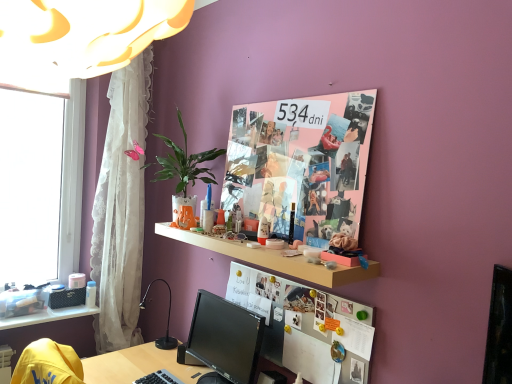
Question: Considering the relative sizes of clear plastic storage at lower left, which is the first shelf in back-to-front order, and whiteboard at center in the image provided, is clear plastic storage at lower left, which is the first shelf in back-to-front order, bigger than whiteboard at center?

Choices:
 (A) yes
 (B) no

Answer: (B)

Question: Considering the relative sizes of clear plastic storage at lower left, arranged as the 1th shelf when viewed from the left, and whiteboard at center in the image provided, is clear plastic storage at lower left, arranged as the 1th shelf when viewed from the left, shorter than whiteboard at center?

Choices:
 (A) yes
 (B) no

Answer: (A)

Question: Are clear plastic storage at lower left, arranged as the 1th shelf when viewed from the left, and whiteboard at center located far from each other?

Choices:
 (A) no
 (B) yes

Answer: (B)

Question: Does clear plastic storage at lower left, the first shelf from the bottom, have a smaller size compared to whiteboard at center?

Choices:
 (A) yes
 (B) no

Answer: (A)

Question: Does clear plastic storage at lower left, which appears as the 2th shelf when viewed from the front, lie behind whiteboard at center?

Choices:
 (A) yes
 (B) no

Answer: (A)

Question: From the image's perspective, is pink paper collage at upper center above or below smooth skin face at upper center?

Choices:
 (A) above
 (B) below

Answer: (B)

Question: Considering the positions of pink paper collage at upper center and smooth skin face at upper center in the image, is pink paper collage at upper center taller or shorter than smooth skin face at upper center?

Choices:
 (A) tall
 (B) short

Answer: (A)

Question: Is point (304, 185) positioned closer to the camera than point (267, 135)?

Choices:
 (A) farther
 (B) closer

Answer: (B)

Question: Considering the relative positions of pink paper collage at upper center and smooth skin face at upper center in the image provided, is pink paper collage at upper center to the left or to the right of smooth skin face at upper center?

Choices:
 (A) left
 (B) right

Answer: (B)

Question: Considering the positions of black glossy monitor at center and black plastic keyboard at lower center in the image, is black glossy monitor at center bigger or smaller than black plastic keyboard at lower center?

Choices:
 (A) small
 (B) big

Answer: (B)

Question: From the image's perspective, is black glossy monitor at center located above or below black plastic keyboard at lower center?

Choices:
 (A) below
 (B) above

Answer: (B)

Question: In terms of height, does black glossy monitor at center look taller or shorter compared to black plastic keyboard at lower center?

Choices:
 (A) tall
 (B) short

Answer: (A)

Question: Is black glossy monitor at center spatially inside black plastic keyboard at lower center, or outside of it?

Choices:
 (A) outside
 (B) inside

Answer: (A)

Question: From a real-world perspective, is black glossy monitor at center above or below white plastic window at left?

Choices:
 (A) below
 (B) above

Answer: (A)

Question: Is black glossy monitor at center bigger or smaller than white plastic window at left?

Choices:
 (A) big
 (B) small

Answer: (B)